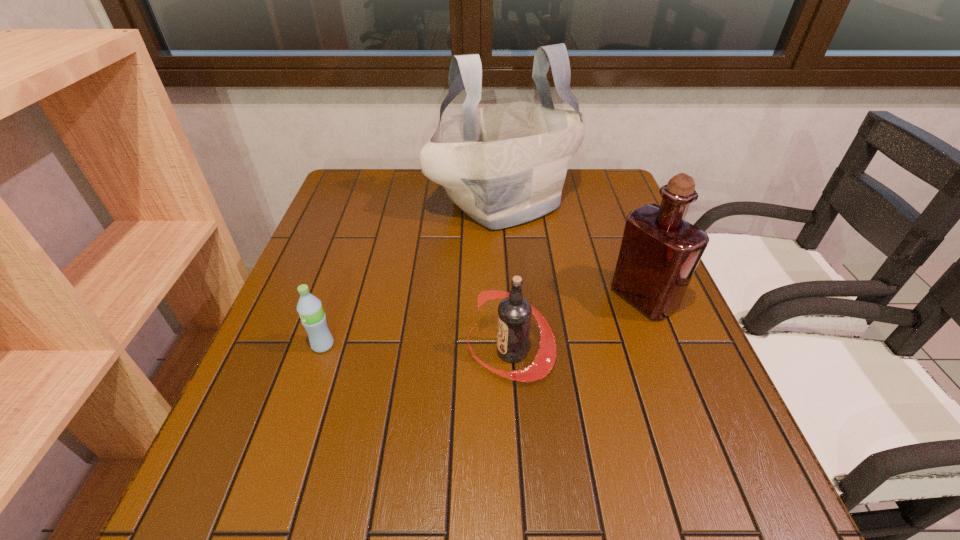
Where is `free space located 0.120m on the label of the second shortest object`? The image size is (960, 540). free space located 0.120m on the label of the second shortest object is located at coordinates (409, 352).

This screenshot has height=540, width=960. I want to click on vacant space situated 0.170m on the label of the second shortest object, so (x=385, y=352).

This screenshot has height=540, width=960. In order to click on free location located on the back of the leftmost object in this screenshot , I will do `click(358, 240)`.

You are a GUI agent. You are given a task and a screenshot of the screen. Output one action in this format:
    pyautogui.click(x=<x>, y=<y>)
    Task: Click on the object located at the far edge
    
    Given the screenshot: What is the action you would take?
    pyautogui.click(x=503, y=165)

Find the location of a particular element. This screenshot has height=540, width=960. object present at the left edge is located at coordinates (309, 307).

Locate an element on the screen. shopping bag present at the right edge is located at coordinates (503, 165).

Find the location of `liquor at the right edge`. liquor at the right edge is located at coordinates (659, 252).

Where is `object that is at the far right corner`? object that is at the far right corner is located at coordinates [x=503, y=165].

You are a GUI agent. You are given a task and a screenshot of the screen. Output one action in this format:
    pyautogui.click(x=<x>, y=<y>)
    Task: Click on the vacant area at the near edge of the desktop
    
    Given the screenshot: What is the action you would take?
    pyautogui.click(x=533, y=495)

The width and height of the screenshot is (960, 540). I want to click on vacant space at the left edge, so click(247, 384).